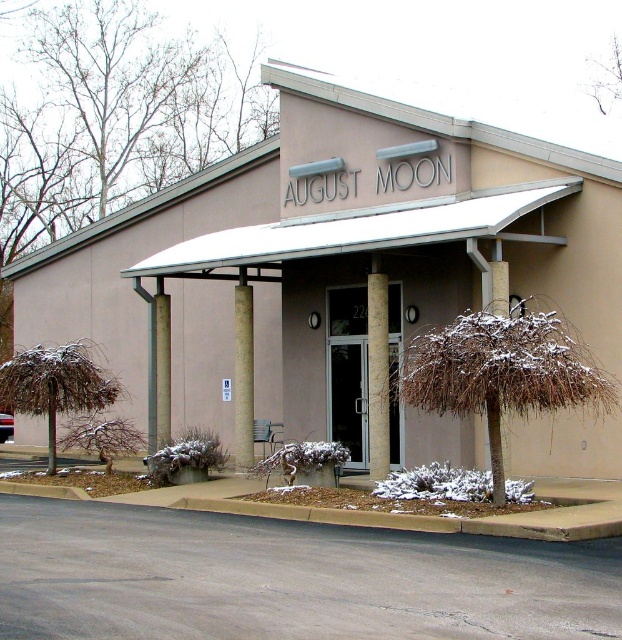
Question: Which is farther from the beige concrete pillar at center?

Choices:
 (A) gray concrete column at center
 (B) gray concrete pillar at center
 (C) beige concrete building at center

Answer: (B)

Question: Can you confirm if beige concrete building at center is thinner than gray concrete column at center?

Choices:
 (A) yes
 (B) no

Answer: (B)

Question: In this image, where is beige concrete building at center located relative to beige concrete pillar at center?

Choices:
 (A) above
 (B) below

Answer: (A)

Question: Which of the following is the farthest from the observer?

Choices:
 (A) (355, 157)
 (B) (234, 413)
 (C) (164, 333)
 (D) (376, 404)

Answer: (B)

Question: Is beige concrete pillar at center wider than gray concrete pillar at center?

Choices:
 (A) yes
 (B) no

Answer: (B)

Question: Which of the following is the farthest from the observer?

Choices:
 (A) beige concrete pillar at center
 (B) gray concrete pillar at center

Answer: (B)